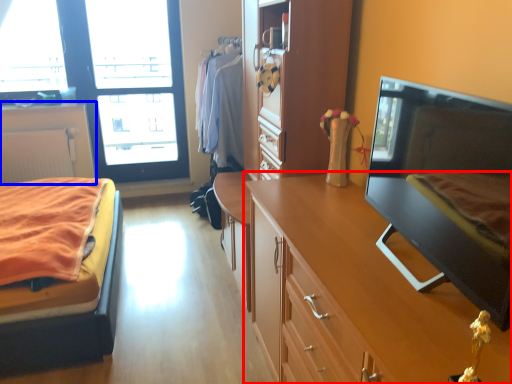
Question: Among these objects, which one is nearest to the camera, cabinetry (highlighted by a red box) or cabinetry (highlighted by a blue box)?

Choices:
 (A) cabinetry
 (B) cabinetry

Answer: (A)